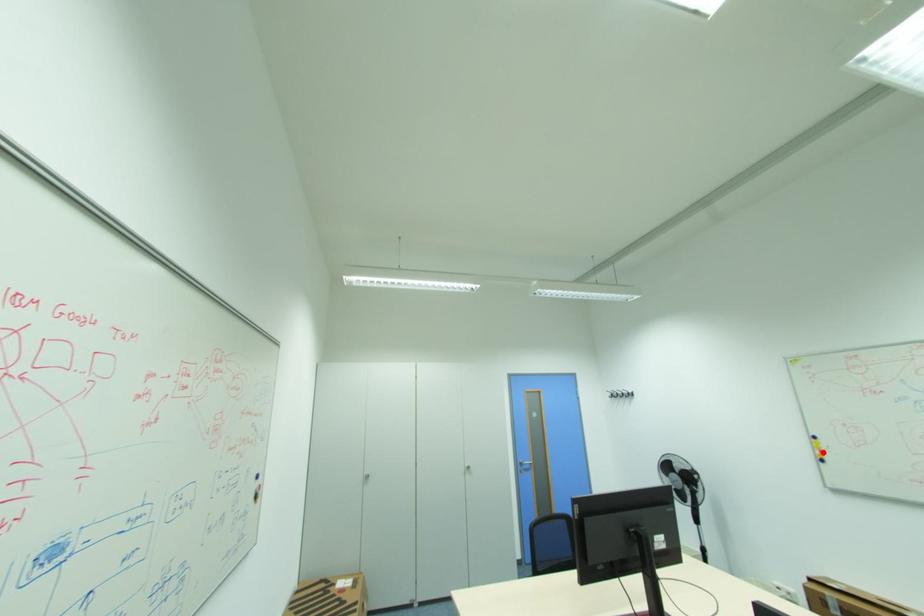
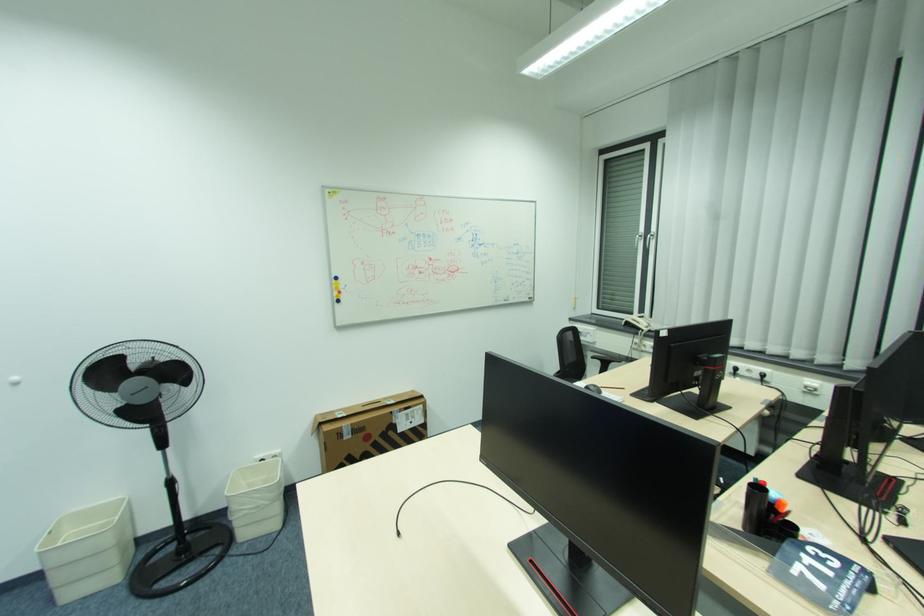
Find the pixel in the second image that matches the highlighted location in the first image.

(341, 294)